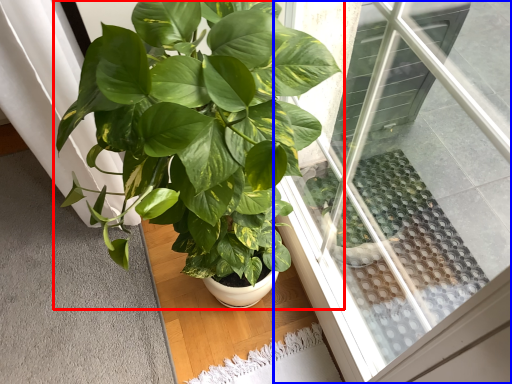
Question: Which object is further to the camera taking this photo, houseplant (highlighted by a red box) or window (highlighted by a blue box)?

Choices:
 (A) houseplant
 (B) window

Answer: (A)